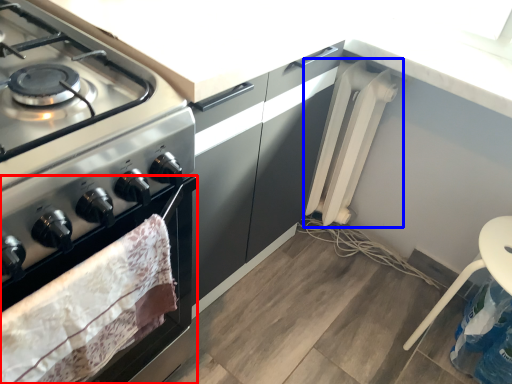
Question: Which object is further to the camera taking this photo, oven (highlighted by a red box) or appliance (highlighted by a blue box)?

Choices:
 (A) oven
 (B) appliance

Answer: (B)